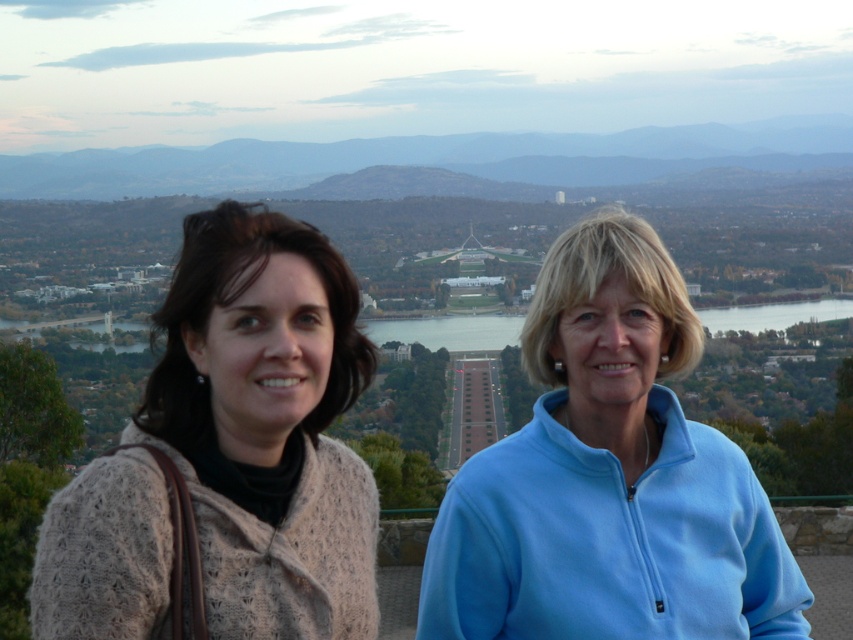
Question: Which object appears farthest from the camera in this image?

Choices:
 (A) blue glassy water at center
 (B) blue hazy mountain at upper center

Answer: (B)

Question: Is knitted beige sweater at left positioned in front of blue fleece jacket at center?

Choices:
 (A) no
 (B) yes

Answer: (B)

Question: Is blue hazy mountain at upper center wider than blue glassy water at center?

Choices:
 (A) yes
 (B) no

Answer: (A)

Question: Does blue hazy mountain at upper center appear under blue glassy water at center?

Choices:
 (A) yes
 (B) no

Answer: (B)

Question: Estimate the real-world distances between objects in this image. Which object is closer to the blue hazy mountain at upper center?

Choices:
 (A) blue glassy water at center
 (B) knitted beige sweater at left
 (C) blue fleece jacket at center

Answer: (A)

Question: Which of the following is the closest to the observer?

Choices:
 (A) blue fleece jacket at center
 (B) knitted beige sweater at left
 (C) blue glassy water at center

Answer: (B)